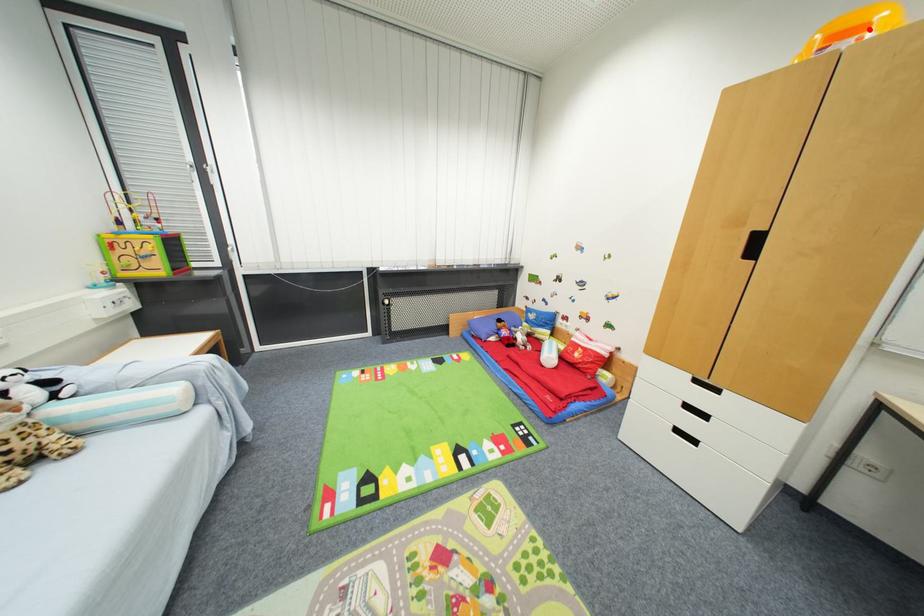
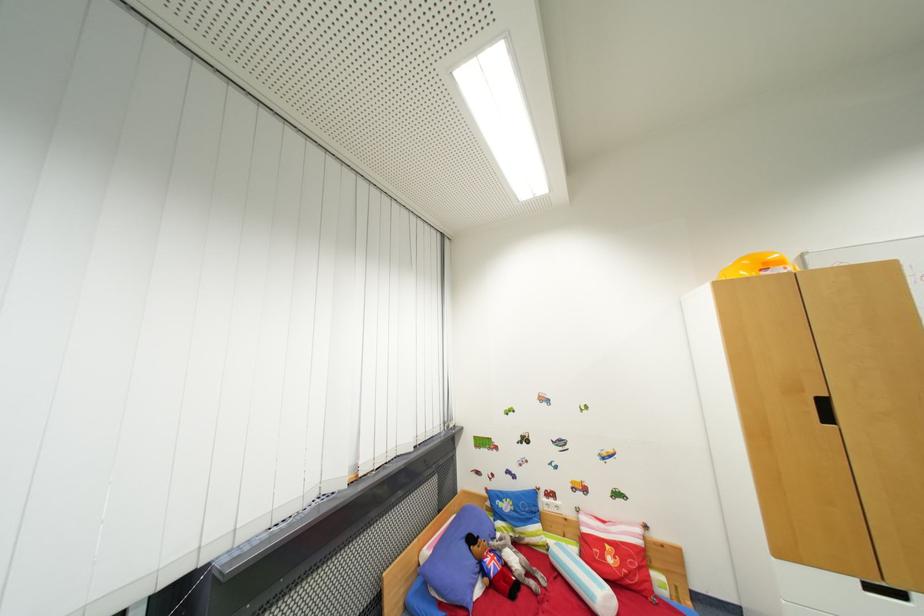
Find the pixel in the second image that matches the highlighted location in the first image.

(785, 265)